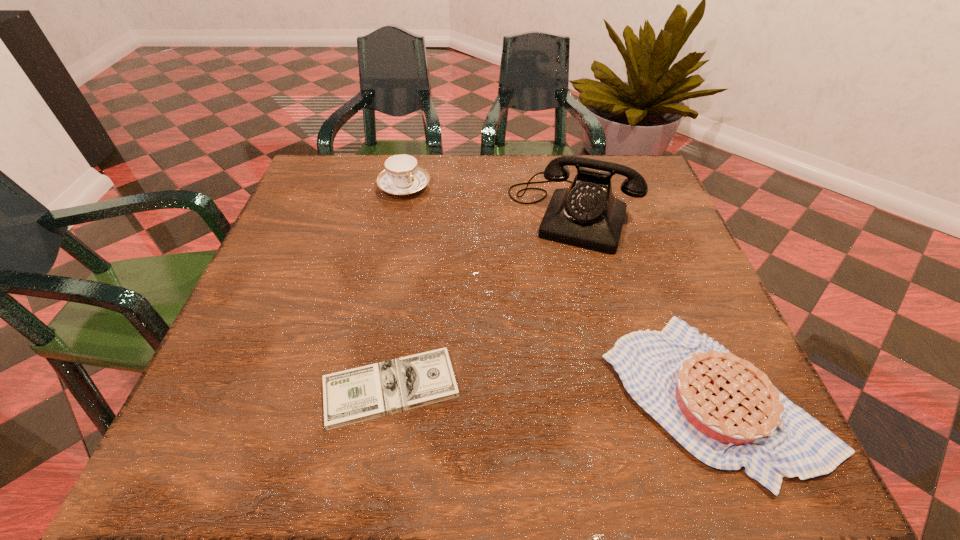
Where is `free spot on the desktop that is between the dollar and the third tallest object and is positioned on the front face of the tallest object`? free spot on the desktop that is between the dollar and the third tallest object and is positioned on the front face of the tallest object is located at coordinates (512, 391).

The image size is (960, 540). Find the location of `vacant space on the desktop that is between the shortest object and the pie and is positioned on the side with the handle of the second tallest object`. vacant space on the desktop that is between the shortest object and the pie and is positioned on the side with the handle of the second tallest object is located at coordinates (598, 393).